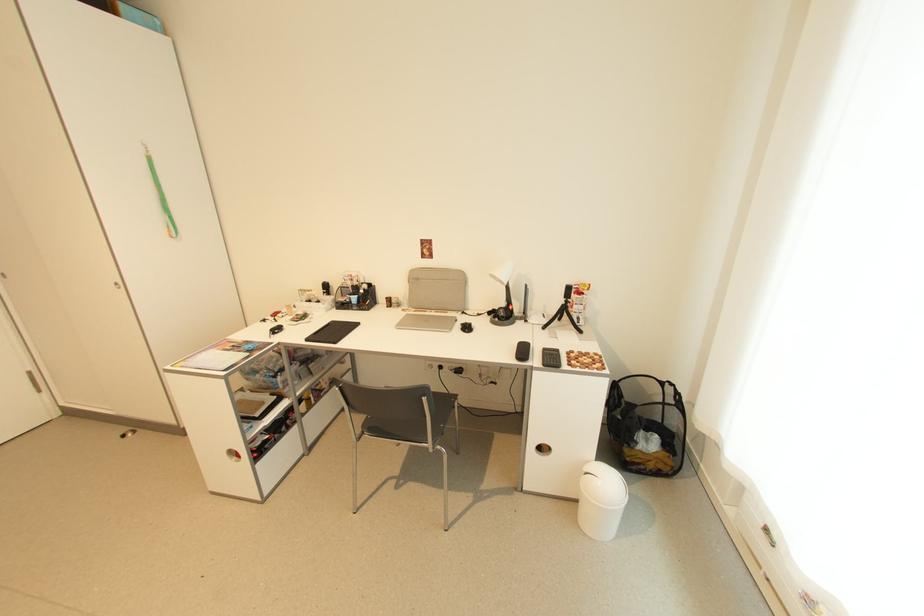
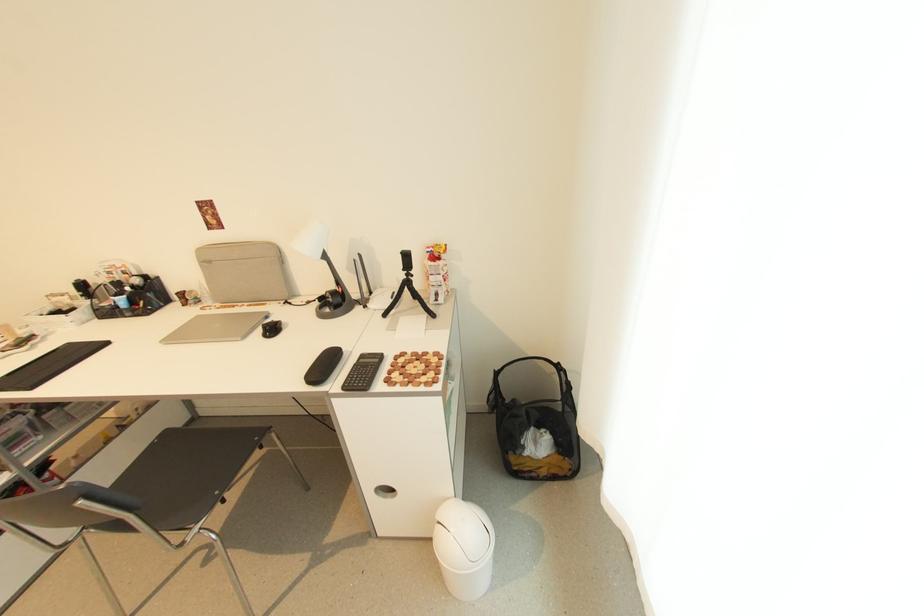
Question: The images are taken continuously from a first-person perspective. In which direction is your viewpoint rotating?

Choices:
 (A) Left
 (B) Right
 (C) Up
 (D) Down

Answer: (D)